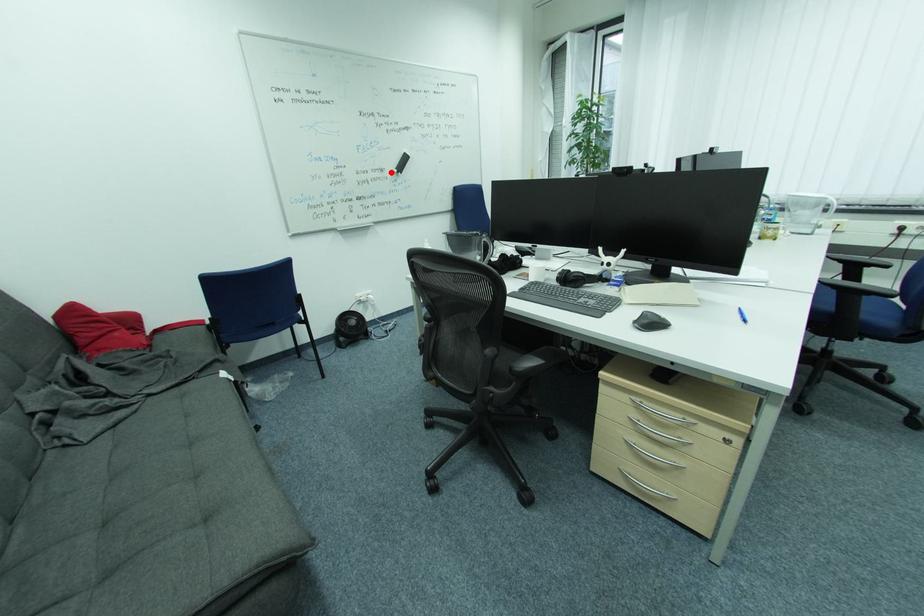
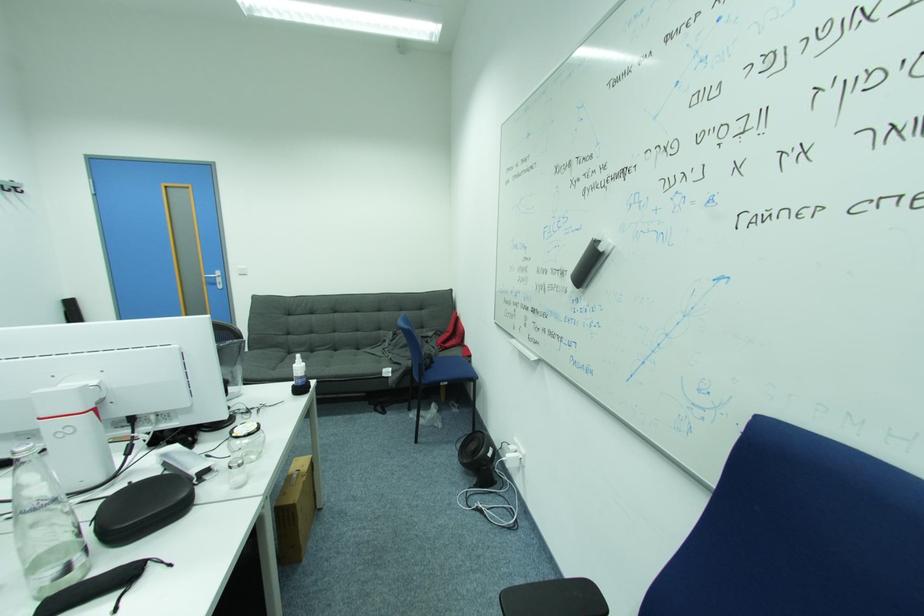
Question: A red point is marked in image1. In image2, is the corresponding 3D point closer to the camera or farther? Reply with the corresponding letter.

Choices:
 (A) The corresponding 3D point is closer.
 (B) The corresponding 3D point is farther.

Answer: (B)